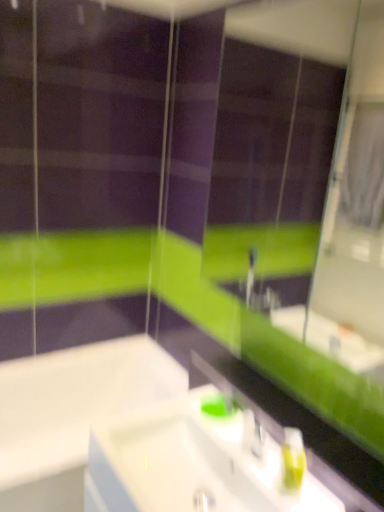
Question: Is white glossy sink at center in front of or behind green matte mirror at upper center in the image?

Choices:
 (A) behind
 (B) front

Answer: (A)

Question: Choose the correct answer: Is white glossy sink at center inside green matte mirror at upper center or outside it?

Choices:
 (A) outside
 (B) inside

Answer: (A)

Question: Based on their relative distances, which object is nearer to the green matte mirror at upper center?

Choices:
 (A) white glossy sink at center
 (B) green matte soap dispenser at lower right
 (C) white glossy bathtub at lower left

Answer: (C)

Question: Which is farther from the green matte soap dispenser at lower right?

Choices:
 (A) green matte mirror at upper center
 (B) white glossy sink at center
 (C) white glossy bathtub at lower left

Answer: (A)